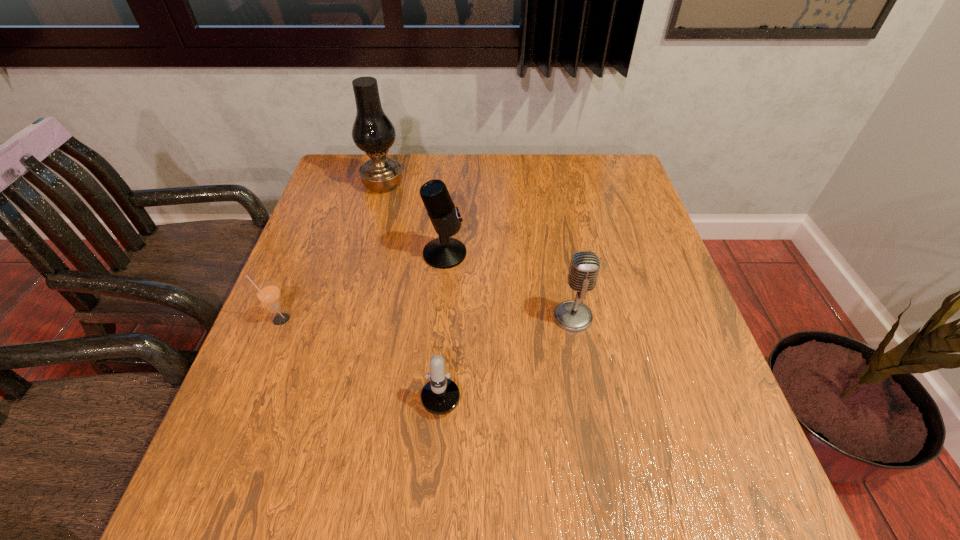
This screenshot has width=960, height=540. Identify the location of free space at the right edge. [629, 235].

This screenshot has height=540, width=960. In order to click on free location at the near left corner of the desktop in this screenshot , I will do `click(275, 480)`.

This screenshot has height=540, width=960. Identify the location of vacant space at the far right corner of the desktop. (601, 184).

Where is `vacant space that is in between the second farthest microphone and the shortest microphone`? This screenshot has width=960, height=540. vacant space that is in between the second farthest microphone and the shortest microphone is located at coordinates (508, 347).

Where is `free space between the nearest microphone and the rightmost object`? The width and height of the screenshot is (960, 540). free space between the nearest microphone and the rightmost object is located at coordinates pos(508,347).

You are a GUI agent. You are given a task and a screenshot of the screen. Output one action in this format:
    pyautogui.click(x=<x>, y=<y>)
    Task: Click on the vacant area that lies between the oil lamp and the farthest microphone
    The width and height of the screenshot is (960, 540).
    Given the screenshot: What is the action you would take?
    pyautogui.click(x=414, y=219)

Locate an element on the screen. empty location between the rightmost object and the farthest object is located at coordinates (478, 251).

The height and width of the screenshot is (540, 960). I want to click on vacant space that's between the leftmost object and the farthest microphone, so coord(362,286).

Where is `vacant area between the straw and the shortest microphone`? The height and width of the screenshot is (540, 960). vacant area between the straw and the shortest microphone is located at coordinates (361, 348).

This screenshot has height=540, width=960. What are the coordinates of `free space that is in between the rightmost object and the farthest object` in the screenshot? It's located at (478, 251).